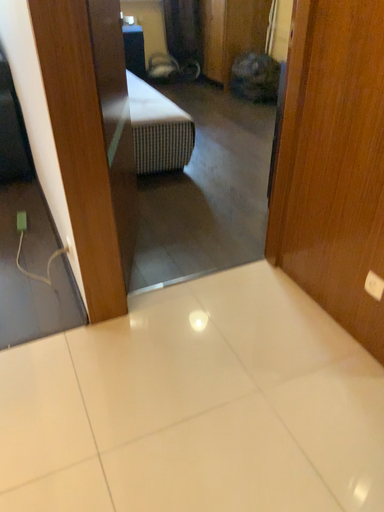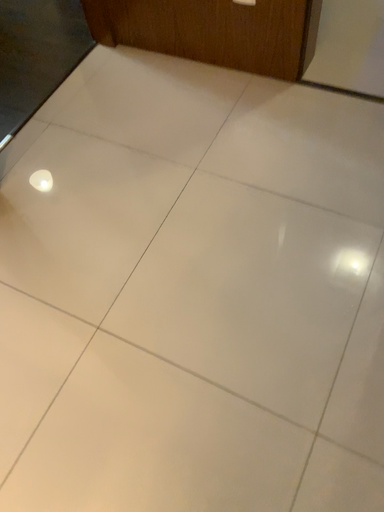
Question: Which way did the camera rotate in the video?

Choices:
 (A) rotated downward
 (B) rotated upward

Answer: (A)